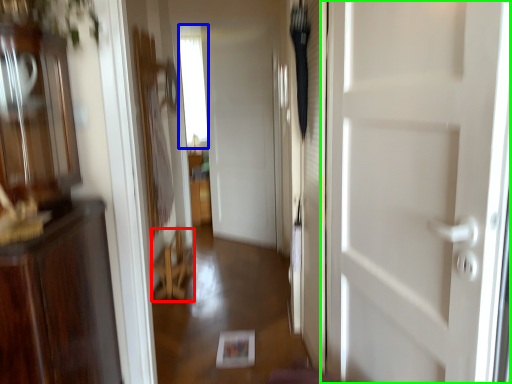
Question: Estimate the real-world distances between objects in this image. Which object is closer to furniture (highlighted by a red box), window (highlighted by a blue box) or door (highlighted by a green box)?

Choices:
 (A) window
 (B) door

Answer: (B)